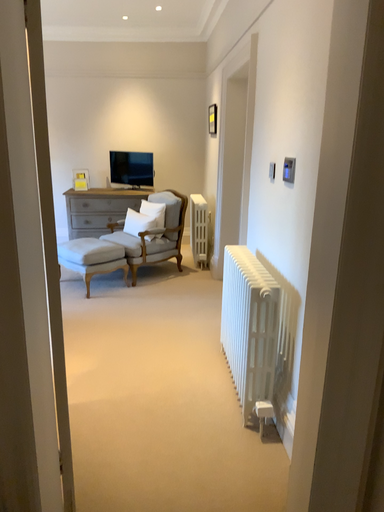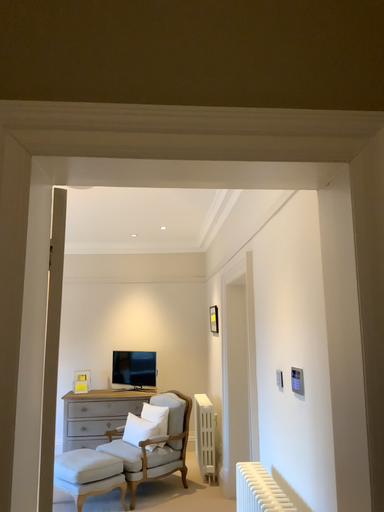
Question: Which way did the camera rotate in the video?

Choices:
 (A) rotated upward
 (B) rotated downward

Answer: (A)